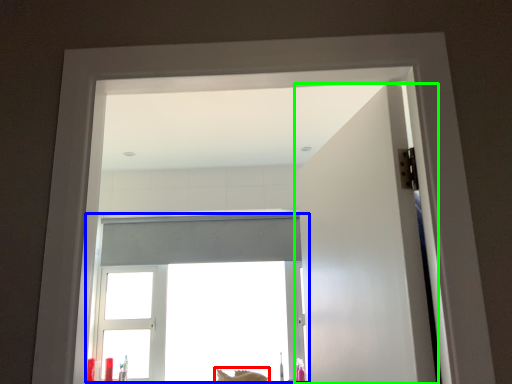
Question: Considering the real-world distances, which object is closest to animal (highlighted by a red box)? window (highlighted by a blue box) or door (highlighted by a green box).

Choices:
 (A) window
 (B) door

Answer: (A)